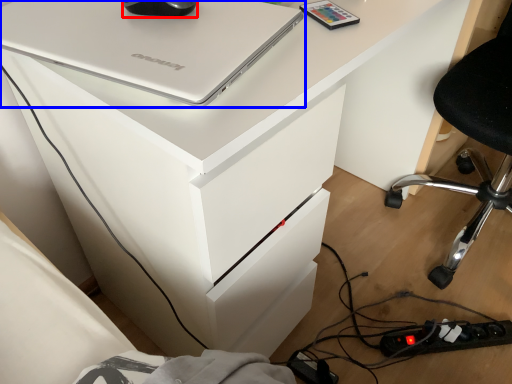
Question: Which point is closer to the camera, mouse (highlighted by a red box) or laptop (highlighted by a blue box)?

Choices:
 (A) mouse
 (B) laptop

Answer: (B)